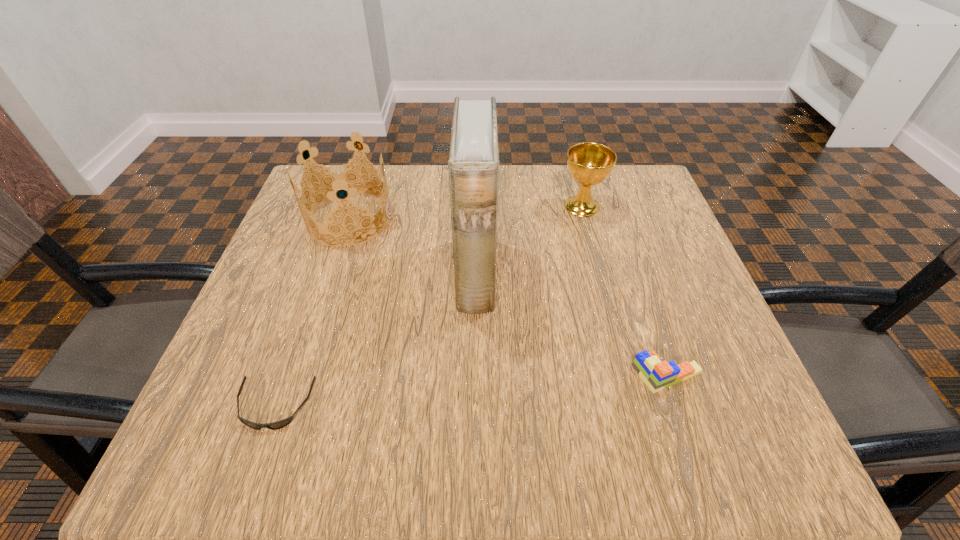
The height and width of the screenshot is (540, 960). What are the coordinates of `the third object from right to left` in the screenshot? It's located at (473, 165).

Where is `phonebook`? This screenshot has width=960, height=540. phonebook is located at coordinates (473, 165).

The height and width of the screenshot is (540, 960). Find the location of `crown`. crown is located at coordinates (338, 178).

Where is `chalice`? chalice is located at coordinates (589, 163).

This screenshot has width=960, height=540. In order to click on Lego in this screenshot , I will do `click(657, 375)`.

Locate an element on the screen. This screenshot has height=540, width=960. the shortest object is located at coordinates (280, 424).

I want to click on free spot located on the cover of the phonebook, so click(650, 275).

The height and width of the screenshot is (540, 960). In order to click on free space located 0.140m on the right of the crown in this screenshot , I will do `click(450, 219)`.

Locate an element on the screen. free location located 0.190m on the left of the third tallest object is located at coordinates (483, 206).

Locate an element on the screen. This screenshot has width=960, height=540. free region located on the back of the second shortest object is located at coordinates (618, 228).